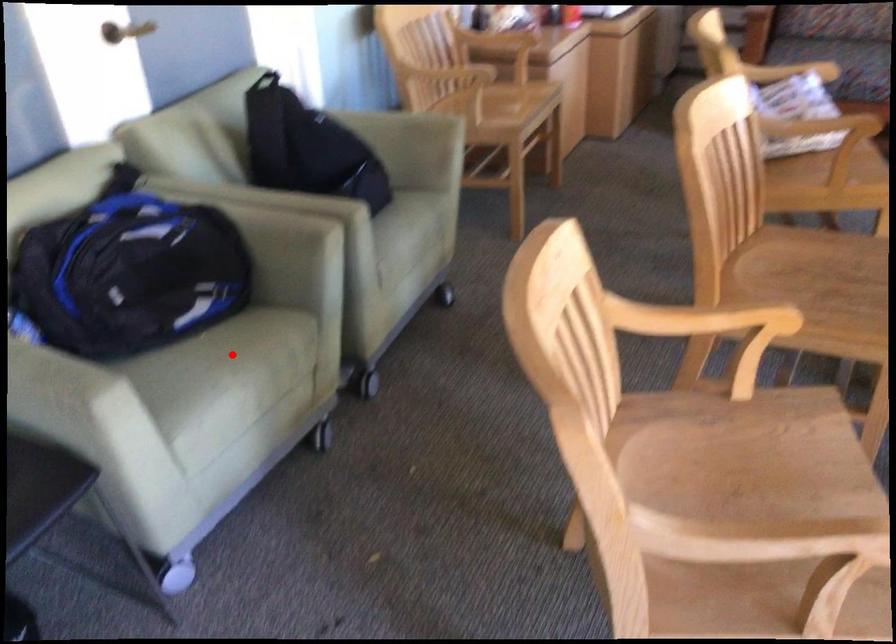
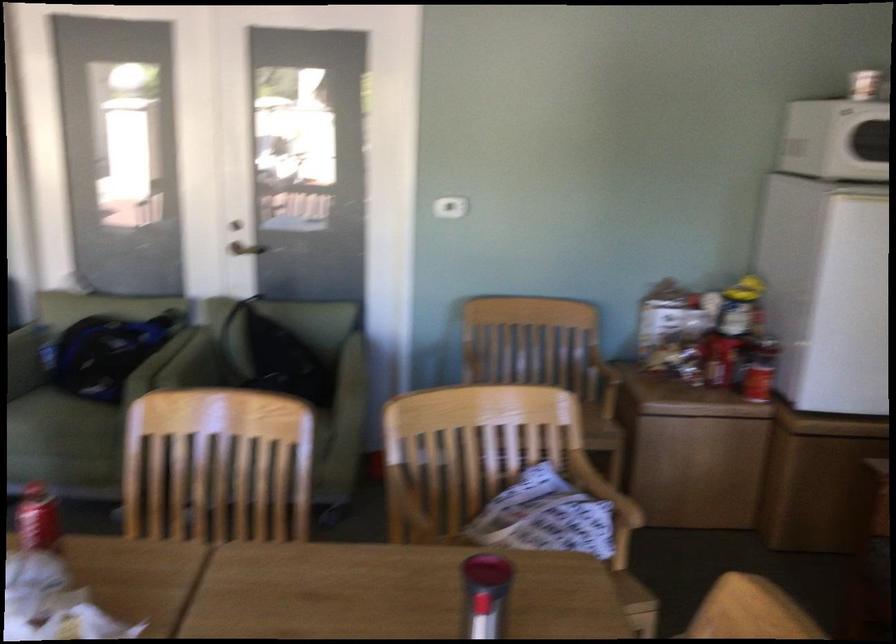
Where in the second image is the point corresponding to the highlighted location from the first image?

(61, 424)